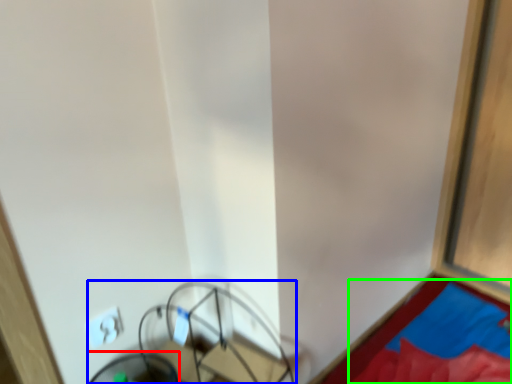
Question: Which object is the closest to the swivel chair (highlighted by a red box)? Choose among these: furniture (highlighted by a blue box) or sheet (highlighted by a green box).

Choices:
 (A) furniture
 (B) sheet

Answer: (A)